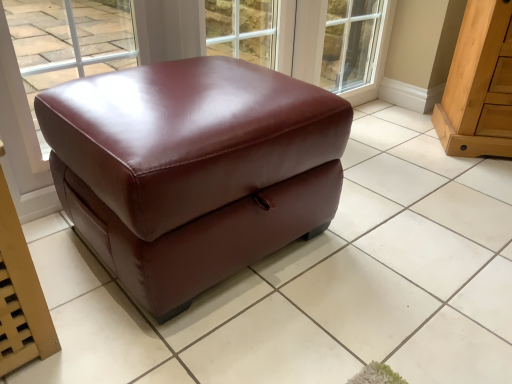
Where is `free location in front of satin brown leather ottoman at center, the 1th furniture from the left`? This screenshot has width=512, height=384. free location in front of satin brown leather ottoman at center, the 1th furniture from the left is located at coordinates (206, 334).